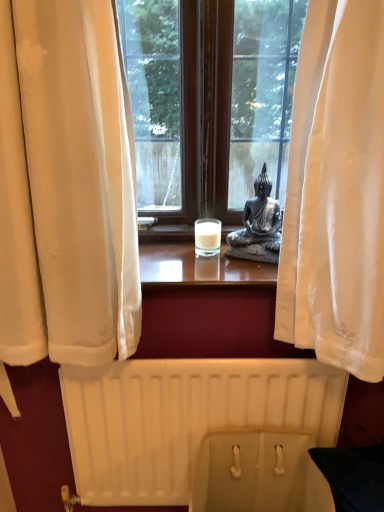
Question: Are satin black statue at center and beige fabric toilet bowl at lower center making contact?

Choices:
 (A) yes
 (B) no

Answer: (B)

Question: Can you confirm if satin black statue at center is smaller than beige fabric toilet bowl at lower center?

Choices:
 (A) no
 (B) yes

Answer: (B)

Question: From the image's perspective, does satin black statue at center appear higher than beige fabric toilet bowl at lower center?

Choices:
 (A) yes
 (B) no

Answer: (A)

Question: Is beige fabric toilet bowl at lower center located within satin black statue at center?

Choices:
 (A) yes
 (B) no

Answer: (B)

Question: From the image's perspective, would you say satin black statue at center is shown under beige fabric toilet bowl at lower center?

Choices:
 (A) yes
 (B) no

Answer: (B)

Question: From a real-world perspective, is satin black statue at center on top of beige fabric toilet bowl at lower center?

Choices:
 (A) no
 (B) yes

Answer: (B)

Question: Is white matte radiator at lower center inside white frosted glass candle at center?

Choices:
 (A) yes
 (B) no

Answer: (B)

Question: From a real-world perspective, is white frosted glass candle at center beneath white matte radiator at lower center?

Choices:
 (A) no
 (B) yes

Answer: (A)

Question: Considering the relative positions of white frosted glass candle at center and white matte radiator at lower center in the image provided, is white frosted glass candle at center to the left of white matte radiator at lower center from the viewer's perspective?

Choices:
 (A) yes
 (B) no

Answer: (B)

Question: Is white frosted glass candle at center next to white matte radiator at lower center and touching it?

Choices:
 (A) yes
 (B) no

Answer: (B)

Question: Does white frosted glass candle at center turn towards white matte radiator at lower center?

Choices:
 (A) no
 (B) yes

Answer: (A)

Question: Considering the relative sizes of white frosted glass candle at center and white matte radiator at lower center in the image provided, is white frosted glass candle at center bigger than white matte radiator at lower center?

Choices:
 (A) no
 (B) yes

Answer: (A)

Question: Is white matte radiator at lower center turned away from beige fabric toilet bowl at lower center?

Choices:
 (A) yes
 (B) no

Answer: (A)